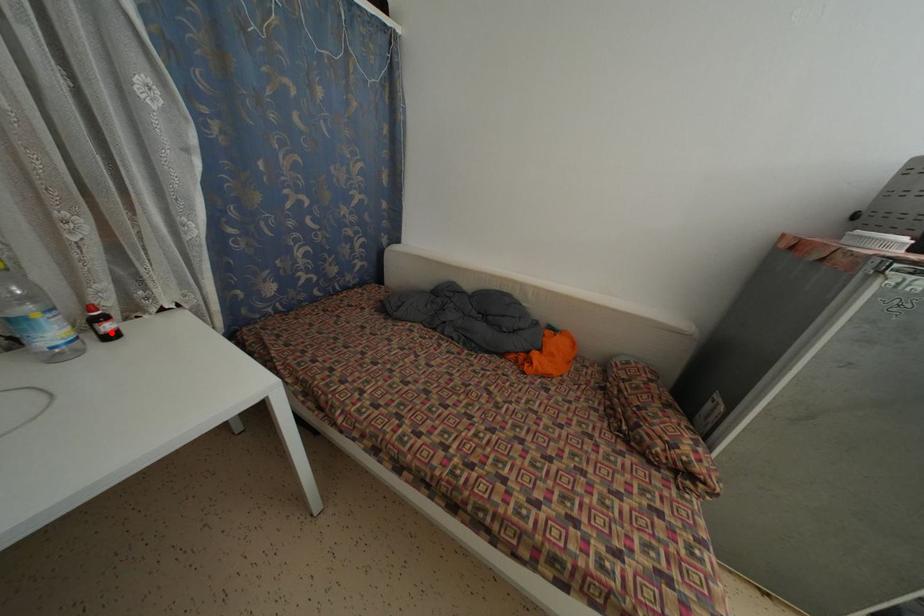
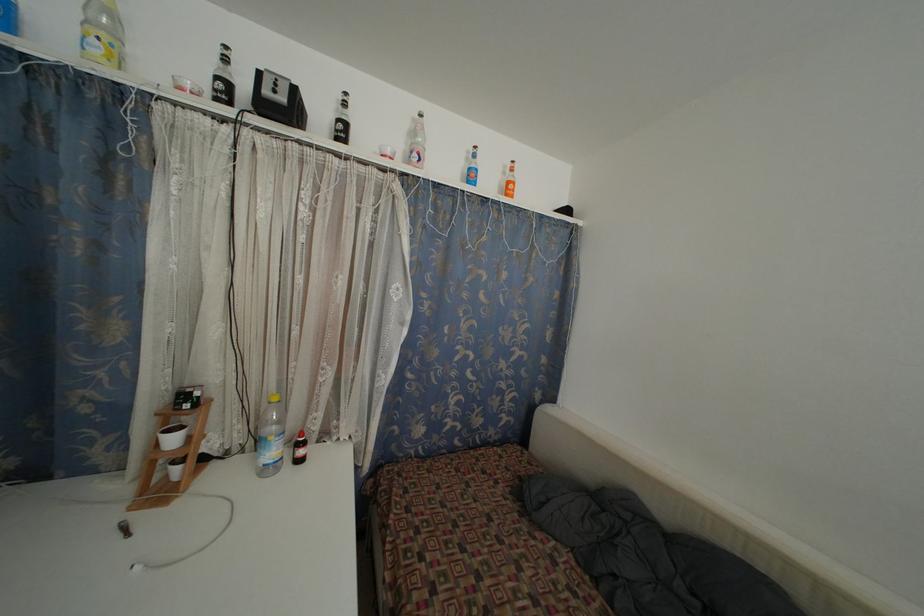
Locate, in the second image, the point that corresponds to the highlighted location in the first image.

(305, 458)